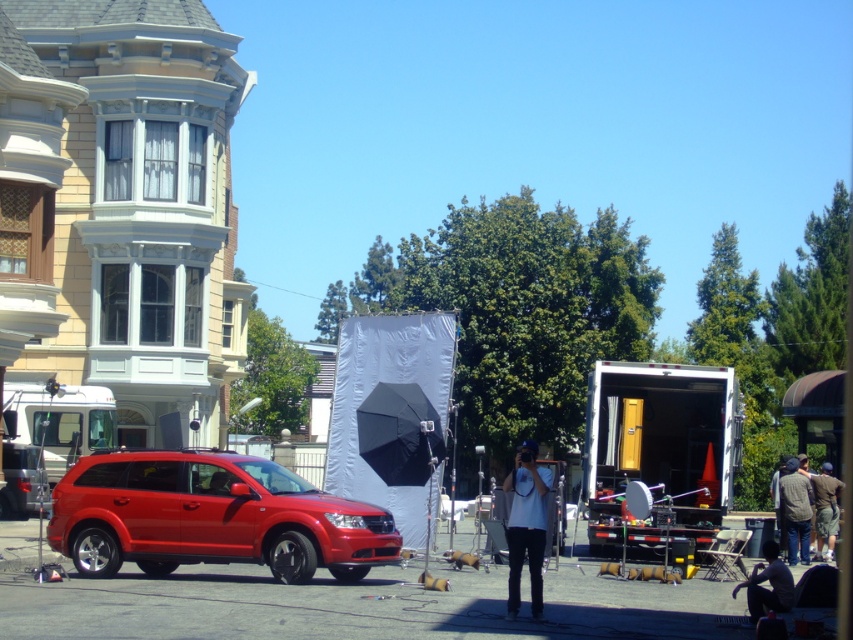
You are a photographer trying to frame a shot that includes both the shiny red suv at center and the white matte shirt at center. Based on their sizes, which object should you position closer to the edges of the frame to ensure both fit within the shot?

The shiny red suv at center is wider than the white matte shirt at center. To ensure both fit within the frame, position the wider shiny red suv at center closer to the edges of the frame, allowing the narrower white matte shirt at center to occupy the central area.

You are a photographer at the scene. You need to adjust the lighting so that the white matte shirt at center and dark gray sweater at lower right are both well lit. Which object is closer to the light source?

The white matte shirt at center is located below dark gray sweater at lower right, so it is closer to the light source.